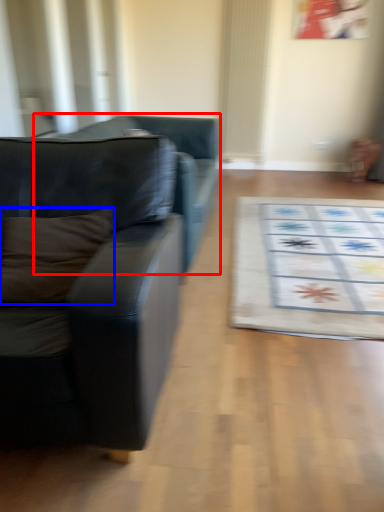
Question: Among these objects, which one is nearest to the camera, studio couch (highlighted by a red box) or pillow (highlighted by a blue box)?

Choices:
 (A) studio couch
 (B) pillow

Answer: (B)